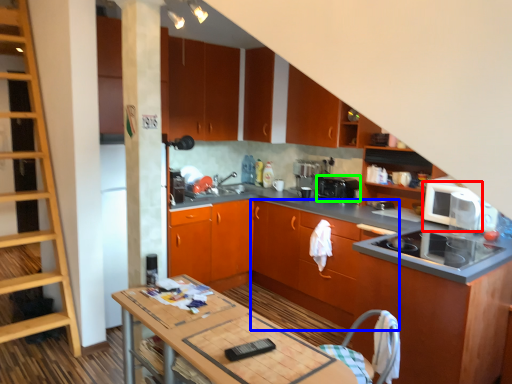
Question: Which object is the farthest from home appliance (highlighted by a red box)? Choose among these: cabinetry (highlighted by a blue box) or kitchen appliance (highlighted by a green box).

Choices:
 (A) cabinetry
 (B) kitchen appliance

Answer: (A)